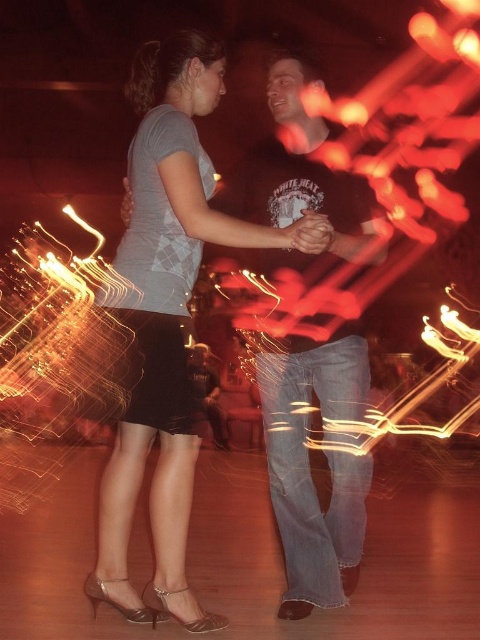
Question: Does matte gray shirt at center have a lesser width compared to dark brown leather pants at center?

Choices:
 (A) yes
 (B) no

Answer: (B)

Question: Which of the following is the closest to the observer?

Choices:
 (A) dark brown leather pants at center
 (B) matte gray shirt at center

Answer: (B)

Question: Which point is farther to the camera?

Choices:
 (A) (180, 291)
 (B) (328, 349)

Answer: (B)

Question: Does matte gray shirt at center appear over dark brown leather pants at center?

Choices:
 (A) no
 (B) yes

Answer: (B)

Question: In this image, where is matte gray shirt at center located relative to dark brown leather pants at center?

Choices:
 (A) above
 (B) below

Answer: (A)